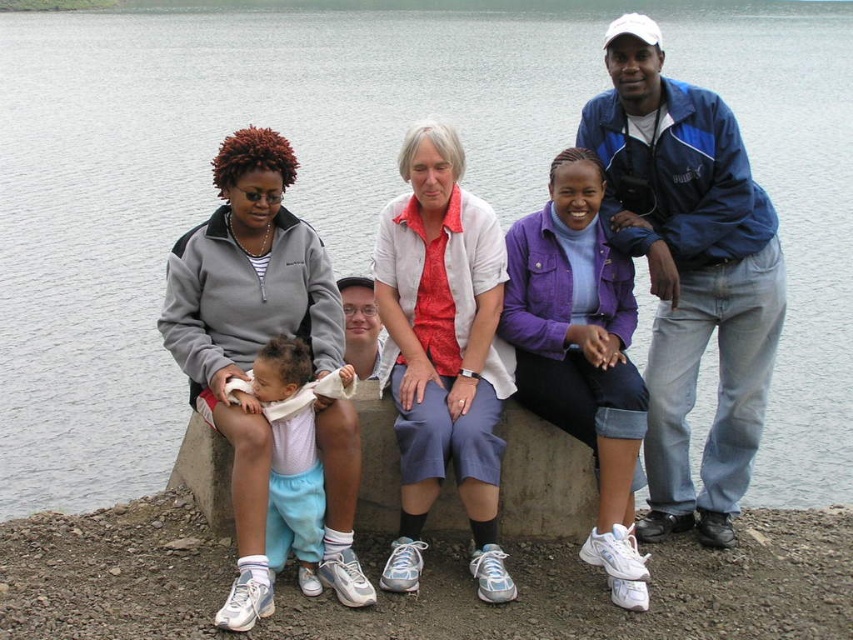
Does point (746, 234) lie behind point (305, 540)?

Yes.

Is blue fabric jacket at upper right to the right of light blue cotton pants at center from the viewer's perspective?

Indeed, blue fabric jacket at upper right is positioned on the right side of light blue cotton pants at center.

Does point (756, 214) lie behind point (242, 392)?

Yes, it is behind point (242, 392).

Locate an element on the screen. This screenshot has width=853, height=640. blue fabric jacket at upper right is located at coordinates (689, 273).

Can you confirm if blue fabric jacket at upper right is positioned to the left of white cotton shirt at center?

In fact, blue fabric jacket at upper right is to the right of white cotton shirt at center.

Is blue fabric jacket at upper right above white cotton shirt at center?

Indeed, blue fabric jacket at upper right is positioned over white cotton shirt at center.

Between point (671, 88) and point (418, 529), which one is positioned in front?

Point (418, 529) is more forward.

Identify the location of blue fabric jacket at upper right. (689, 273).

Is point (395, 260) positioned behind point (766, 371)?

That is False.

Between matte gray sweatshirt at left and blue fabric jacket at upper right, which one appears on the left side from the viewer's perspective?

matte gray sweatshirt at left

Where is `matte gray sweatshirt at left`? matte gray sweatshirt at left is located at coordinates (445, 336).